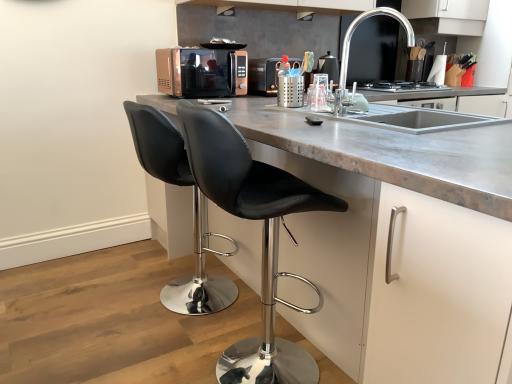
Image resolution: width=512 pixels, height=384 pixels. What are the coordinates of `vacant area situated below black leather stool at lower left, positioned as the 1th chair in back-to-front order (from a real-world perspective)` in the screenshot? It's located at (173, 299).